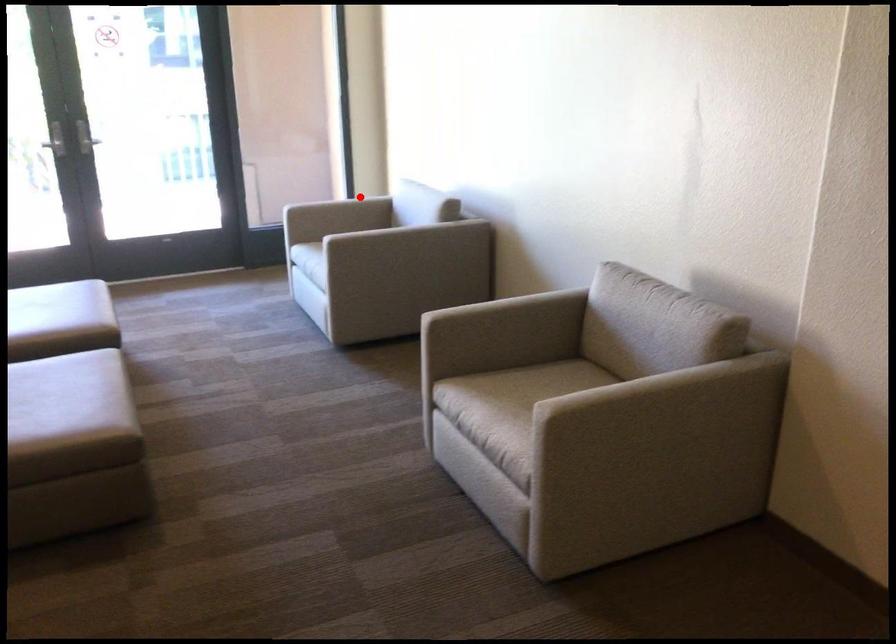
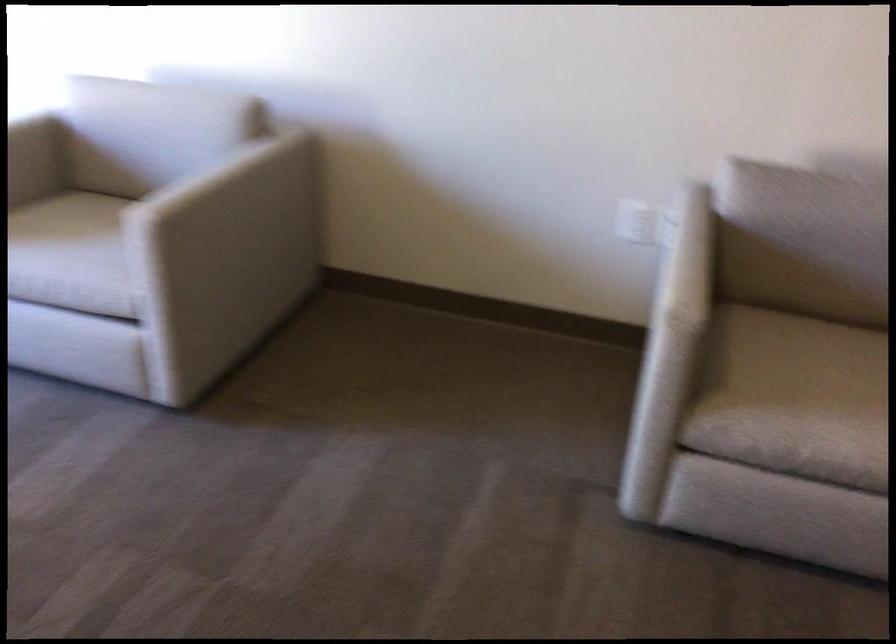
Question: I am providing you with two images of the same scene from different viewpoints. In image1, a red point is highlighted. Considering the same 3D point in image2, which of the following is correct?

Choices:
 (A) It is closer
 (B) It is farther

Answer: (A)